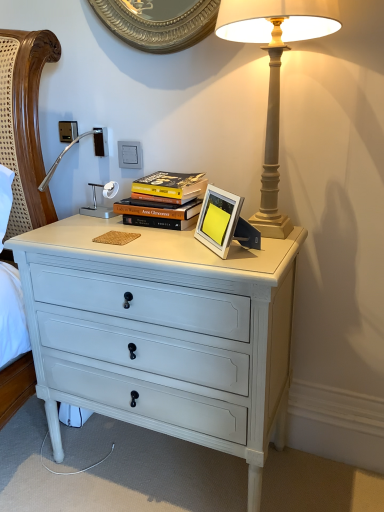
Find the location of `vacant space that is to the left of matte beige lamp at upper right`. vacant space that is to the left of matte beige lamp at upper right is located at coordinates (167, 239).